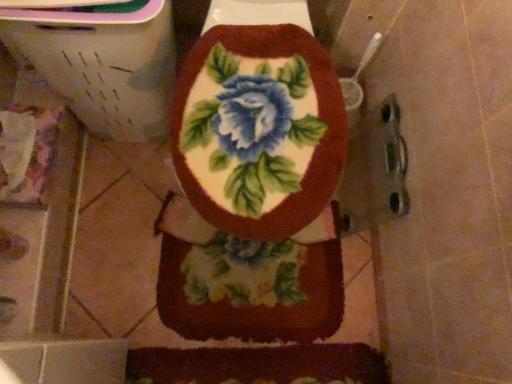
Identify the location of vacant space to the left of fluffy floral rug at center. This screenshot has width=512, height=384. (118, 236).